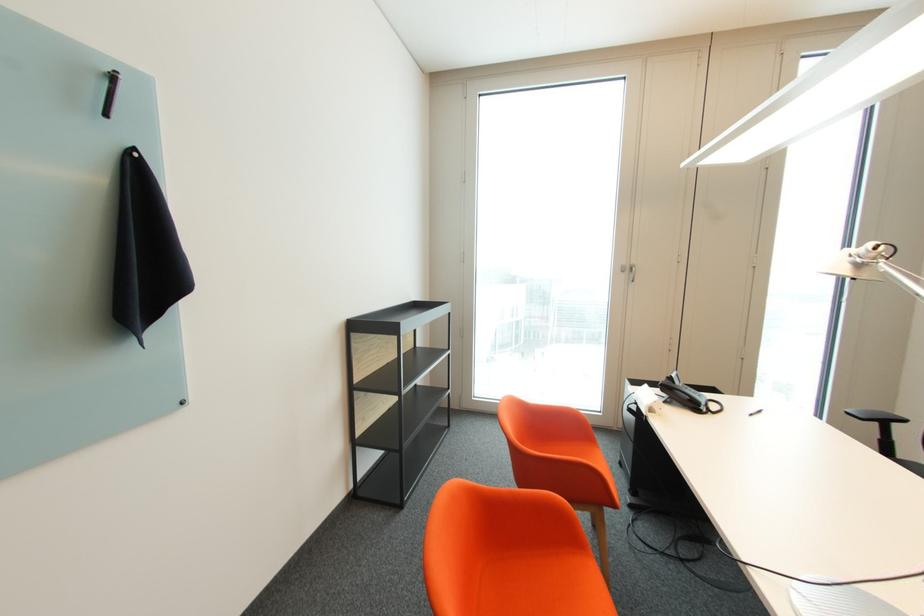
Find where to lift the telephone handset. Please return your answer as a coordinate pair (x, y).

(681, 392)